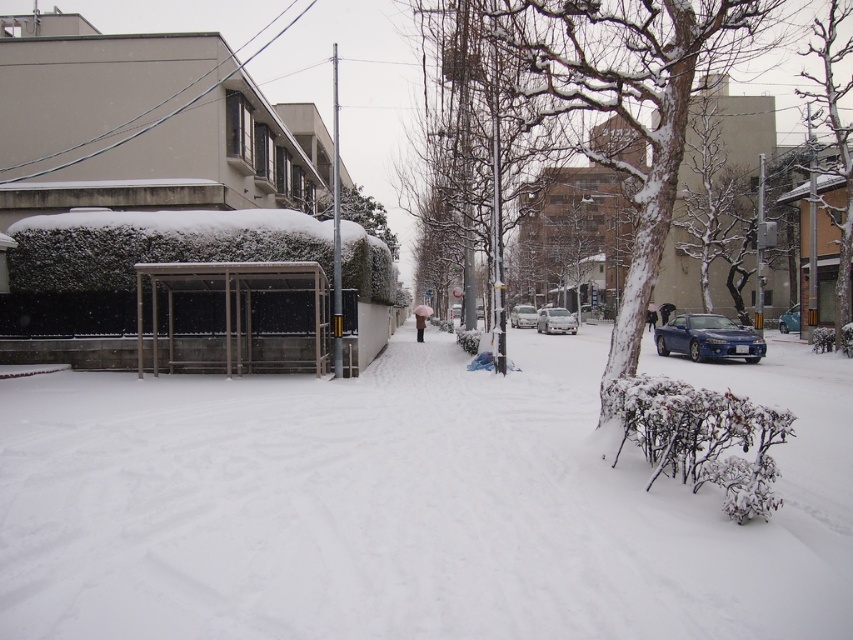
Question: Is snow-covered tree at right above blue metallic car at right?

Choices:
 (A) yes
 (B) no

Answer: (A)

Question: Considering the relative positions of snow-covered bark tree at center and snow-covered tree at right in the image provided, where is snow-covered bark tree at center located with respect to snow-covered tree at right?

Choices:
 (A) above
 (B) below

Answer: (B)

Question: Which object is positioned farthest from the blue metallic car at right?

Choices:
 (A) snow-covered bark tree at center
 (B) shiny blue car at center
 (C) white glossy sedan at center

Answer: (C)

Question: Is shiny blue car at center bigger than blue metallic car at right?

Choices:
 (A) yes
 (B) no

Answer: (B)

Question: Which point appears farthest from the camera in this image?

Choices:
 (A) (703, 321)
 (B) (532, 323)
 (C) (569, 321)

Answer: (B)

Question: Estimate the real-world distances between objects in this image. Which object is closer to the shiny blue car at center?

Choices:
 (A) snow-covered bark tree at center
 (B) blue metallic car at right
 (C) white matte van at center

Answer: (A)